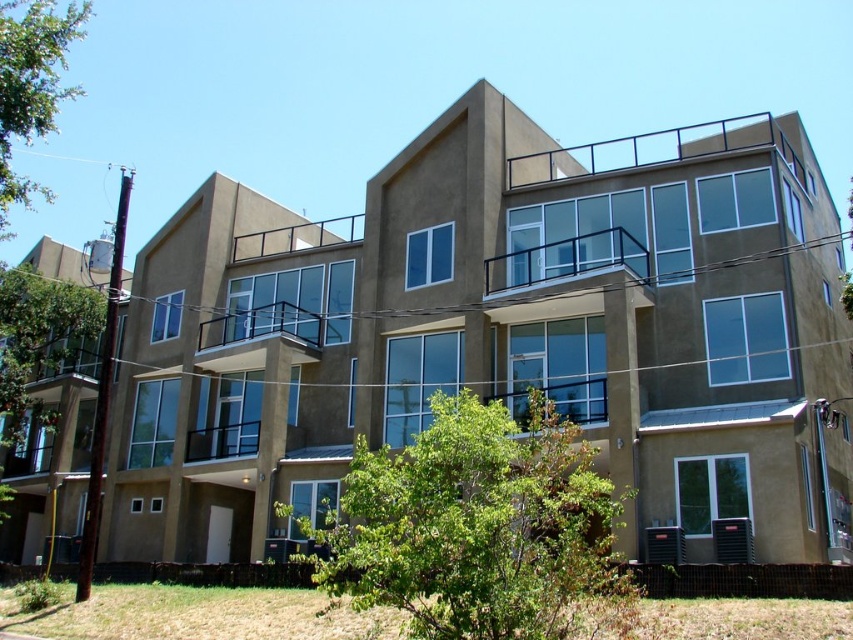
Does green leafy tree at upper left have a smaller size compared to metallic silver balcony at center?

Actually, green leafy tree at upper left might be larger than metallic silver balcony at center.

Is point (13, 38) in front of point (270, 316)?

Yes, point (13, 38) is closer to viewer.

Is point (67, 22) positioned behind point (213, 342)?

No.

This screenshot has height=640, width=853. What are the coordinates of `green leafy tree at upper left` in the screenshot? It's located at (32, 84).

Does green leafy tree at left have a lesser height compared to black metal railing at upper center?

Yes, green leafy tree at left is shorter than black metal railing at upper center.

Who is positioned more to the right, green leafy tree at left or black metal railing at upper center?

From the viewer's perspective, black metal railing at upper center appears more on the right side.

The image size is (853, 640). What do you see at coordinates (39, 340) in the screenshot?
I see `green leafy tree at left` at bounding box center [39, 340].

Where is `green leafy tree at left`? green leafy tree at left is located at coordinates (39, 340).

From the picture: Who is shorter, green leafy tree at center or metallic silver balcony at center?

With less height is metallic silver balcony at center.

Does green leafy tree at center appear on the right side of metallic silver balcony at center?

Indeed, green leafy tree at center is positioned on the right side of metallic silver balcony at center.

Between point (554, 452) and point (300, 339), which one is positioned in front?

Positioned in front is point (554, 452).

Where is `green leafy tree at center`? The width and height of the screenshot is (853, 640). green leafy tree at center is located at coordinates (474, 524).